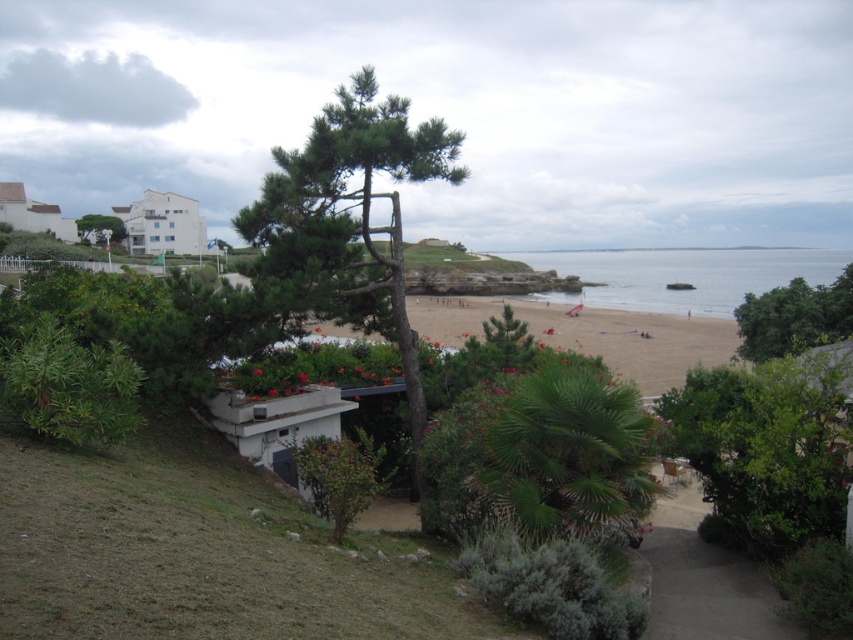
Question: Which of the following is the farthest from the observer?

Choices:
 (A) (305, 204)
 (B) (79, 234)
 (C) (567, 300)
 (D) (753, 346)

Answer: (C)

Question: In this image, where is green textured tree at center located relative to green leafy tree at center?

Choices:
 (A) right
 (B) left

Answer: (A)

Question: Which point appears farthest from the camera in this image?

Choices:
 (A) [x=802, y=282]
 (B) [x=604, y=256]
 (C) [x=637, y=371]

Answer: (B)

Question: Does green textured tree at center have a greater width compared to clear blue water at center?

Choices:
 (A) yes
 (B) no

Answer: (B)

Question: Considering the real-world distances, which object is closest to the brown sandy beach at center?

Choices:
 (A) green textured tree at center
 (B) green leafy tree at lower right
 (C) clear blue water at center
 (D) green leafy tree at center

Answer: (B)

Question: Is green textured tree at center to the right of brown sandy beach at center from the viewer's perspective?

Choices:
 (A) yes
 (B) no

Answer: (B)